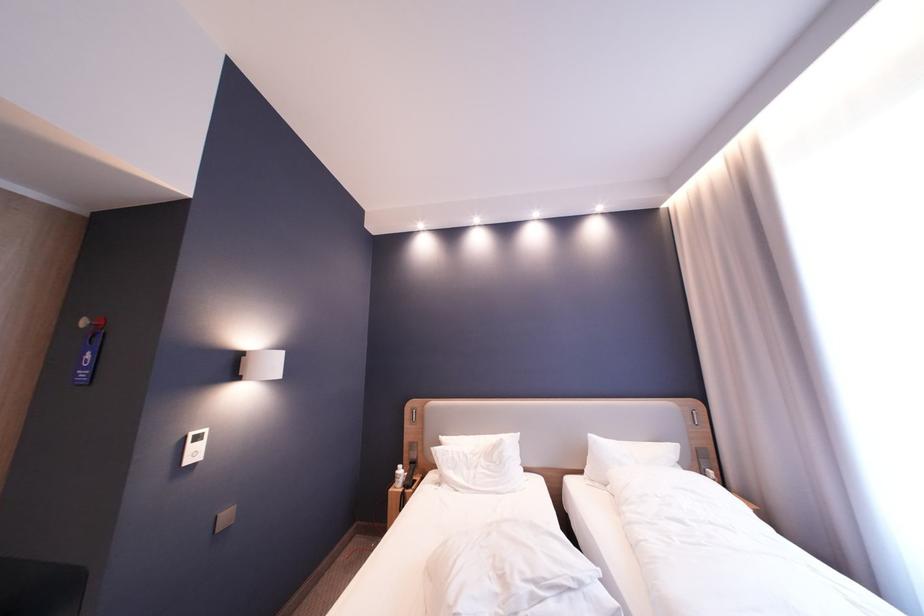
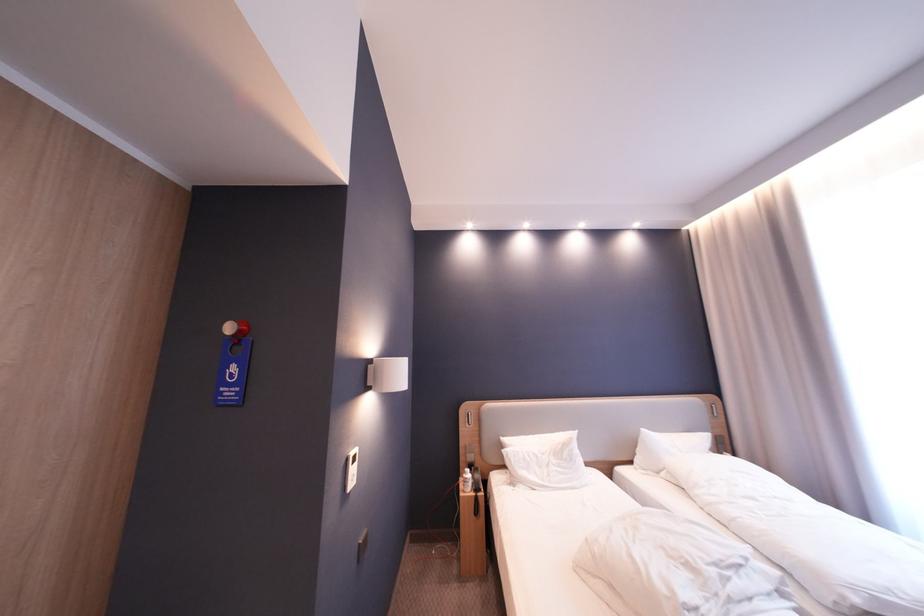
Locate, in the second image, the point that corresponds to [480,456] in the first image.

(550, 456)